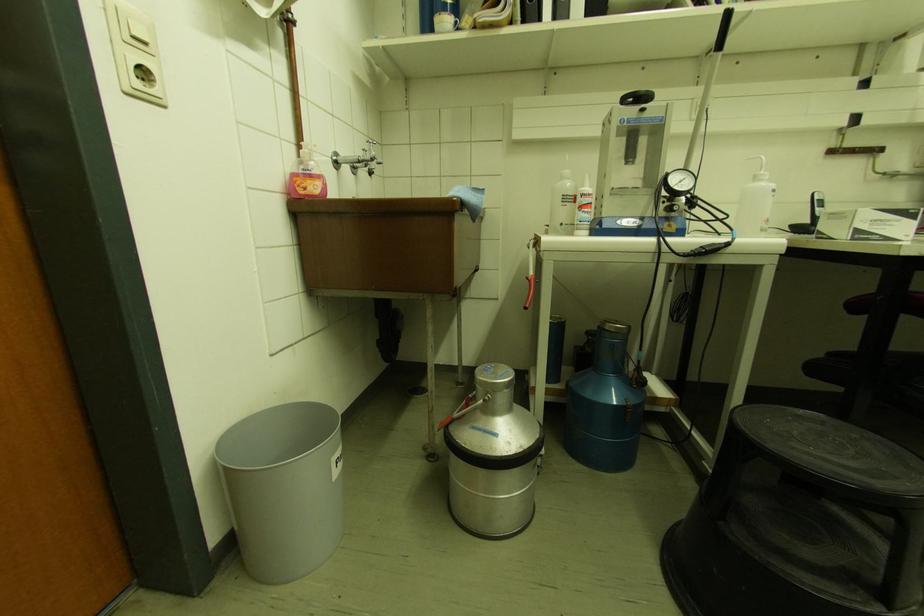
Where is `black step stool`? black step stool is located at coordinates (830, 448).